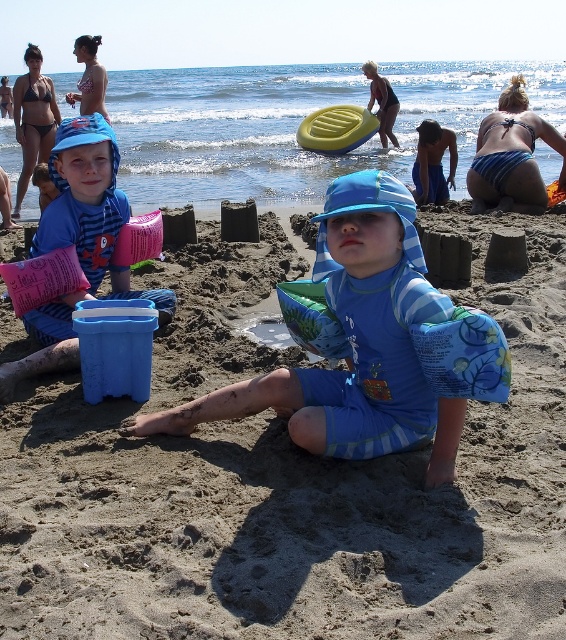
Looking at this image, can you confirm if smooth sand at center is taller than pink fabric bucket at left?

Incorrect, smooth sand at center's height is not larger of pink fabric bucket at left's.

Can you confirm if smooth sand at center is wider than pink fabric bucket at left?

Correct, the width of smooth sand at center exceeds that of pink fabric bucket at left.

Is point (402, 593) farther from viewer compared to point (102, 131)?

No, it is not.

This screenshot has width=566, height=640. In order to click on smooth sand at center in this screenshot , I will do `click(289, 481)`.

Measure the distance between smooth sand at center and camera.

2.00 meters

Can you confirm if smooth sand at center is smaller than blue fabric swimsuit at center?

Actually, smooth sand at center might be larger than blue fabric swimsuit at center.

Between point (19, 429) and point (376, 397), which one is positioned behind?

Point (19, 429)

Where is `smooth sand at center`? The width and height of the screenshot is (566, 640). smooth sand at center is located at coordinates (289, 481).

Does point (325, 372) come in front of point (512, 161)?

Yes, point (325, 372) is in front of point (512, 161).

Is point (443, 340) positioned behind point (538, 134)?

No, (443, 340) is closer to viewer.

Where is `blue fabric swimsuit at center`? This screenshot has width=566, height=640. blue fabric swimsuit at center is located at coordinates (371, 346).